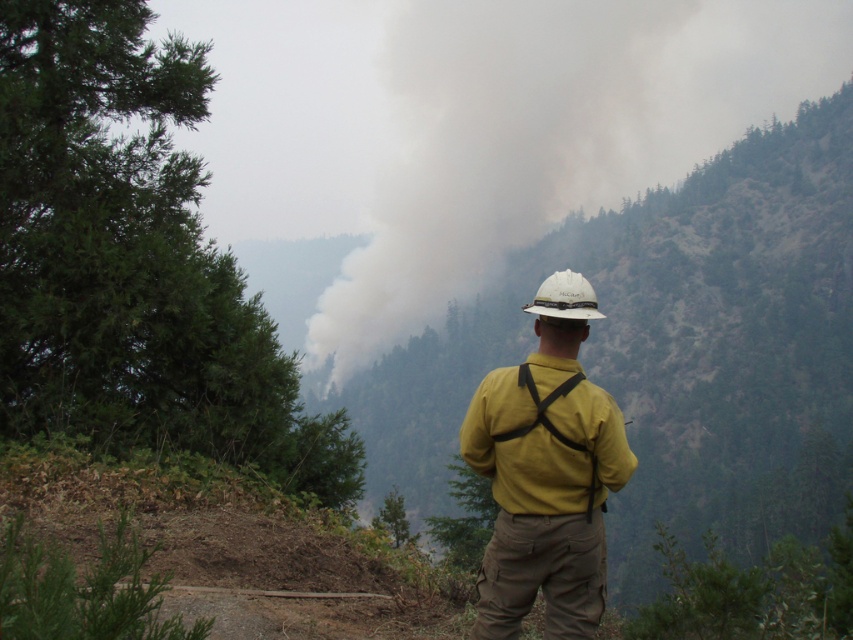
Question: Is yellow fire-resistant shirt at center below yellow matte jacket at center?

Choices:
 (A) yes
 (B) no

Answer: (B)

Question: Based on their relative distances, which object is nearer to the yellow matte jacket at center?

Choices:
 (A) yellow fire-resistant shirt at center
 (B) smoke/dense at center
 (C) white matte hard hat at center

Answer: (A)

Question: Is yellow fire-resistant shirt at center thinner than white matte hard hat at center?

Choices:
 (A) yes
 (B) no

Answer: (A)

Question: Which is nearer to the yellow matte jacket at center?

Choices:
 (A) yellow fire-resistant shirt at center
 (B) white matte hard hat at center

Answer: (A)

Question: Can you confirm if yellow fire-resistant shirt at center is wider than white matte hard hat at center?

Choices:
 (A) no
 (B) yes

Answer: (A)

Question: Among these points, which one is nearest to the camera?

Choices:
 (A) (564, 141)
 (B) (553, 492)
 (C) (554, 339)
 (D) (560, 273)

Answer: (B)